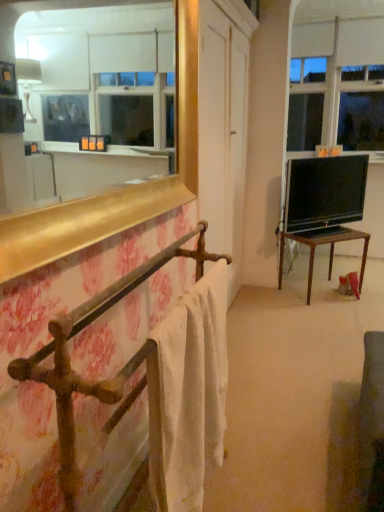
Question: Is rusty metal towel rack at left aimed at white cotton towel at left?

Choices:
 (A) yes
 (B) no

Answer: (A)

Question: Is rusty metal towel rack at left directly adjacent to white cotton towel at left?

Choices:
 (A) yes
 (B) no

Answer: (B)

Question: From a real-world perspective, is rusty metal towel rack at left on white cotton towel at left?

Choices:
 (A) no
 (B) yes

Answer: (A)

Question: From a real-world perspective, is rusty metal towel rack at left physically below white cotton towel at left?

Choices:
 (A) yes
 (B) no

Answer: (A)

Question: Can you confirm if rusty metal towel rack at left is taller than white cotton towel at left?

Choices:
 (A) yes
 (B) no

Answer: (A)

Question: Does rusty metal towel rack at left have a lesser height compared to white cotton towel at left?

Choices:
 (A) yes
 (B) no

Answer: (B)

Question: Is black glossy tv at right wider than transparent glass window at upper right?

Choices:
 (A) no
 (B) yes

Answer: (A)

Question: Is black glossy tv at right facing away from transparent glass window at upper right?

Choices:
 (A) no
 (B) yes

Answer: (A)

Question: Does black glossy tv at right have a greater height compared to transparent glass window at upper right?

Choices:
 (A) no
 (B) yes

Answer: (A)

Question: Is black glossy tv at right positioned before transparent glass window at upper right?

Choices:
 (A) yes
 (B) no

Answer: (A)

Question: Is black glossy tv at right positioned behind transparent glass window at upper right?

Choices:
 (A) yes
 (B) no

Answer: (B)

Question: From a real-world perspective, is black glossy tv at right physically below transparent glass window at upper right?

Choices:
 (A) yes
 (B) no

Answer: (A)

Question: From a real-world perspective, is rusty metal towel rack at left located beneath black glossy tv at right?

Choices:
 (A) yes
 (B) no

Answer: (A)